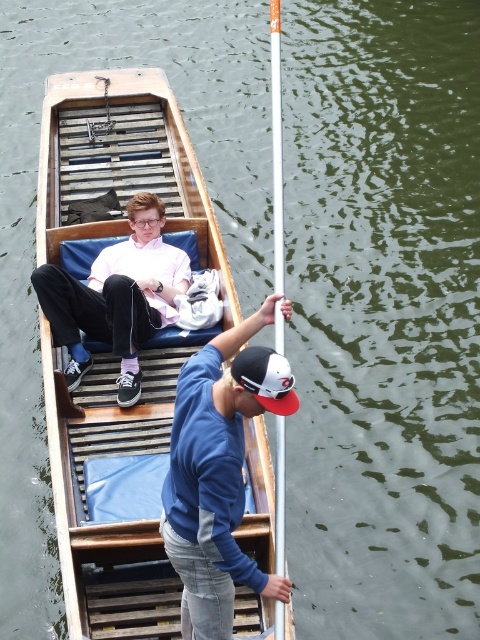
You are standing on the dock and want to locate the blue cotton shirt at center. According to the coordinates provided, in which direction should you look relative to the boat?

The blue cotton shirt at center is located at point (217, 474). Since the boat is at lower right, you should look towards the center of the image where the coordinates indicate the shirt is placed.

You are a photographer trying to capture both the wooden boat at center and the matte pink shirt at center in a single shot. Based on their sizes in the image, which object should you focus on first to ensure both are in frame?

The wooden boat at center is smaller than the matte pink shirt at center. To ensure both are in frame, focus on the wooden boat at center first since it is smaller and requires more careful framing to include both objects.